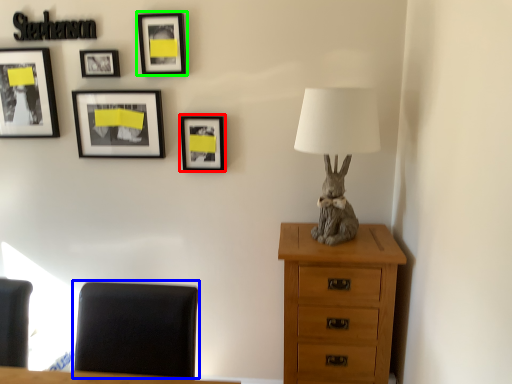
Question: Which object is positioned farthest from picture frame (highlighted by a red box)? Select from furniture (highlighted by a blue box) and picture frame (highlighted by a green box).

Choices:
 (A) furniture
 (B) picture frame

Answer: (A)